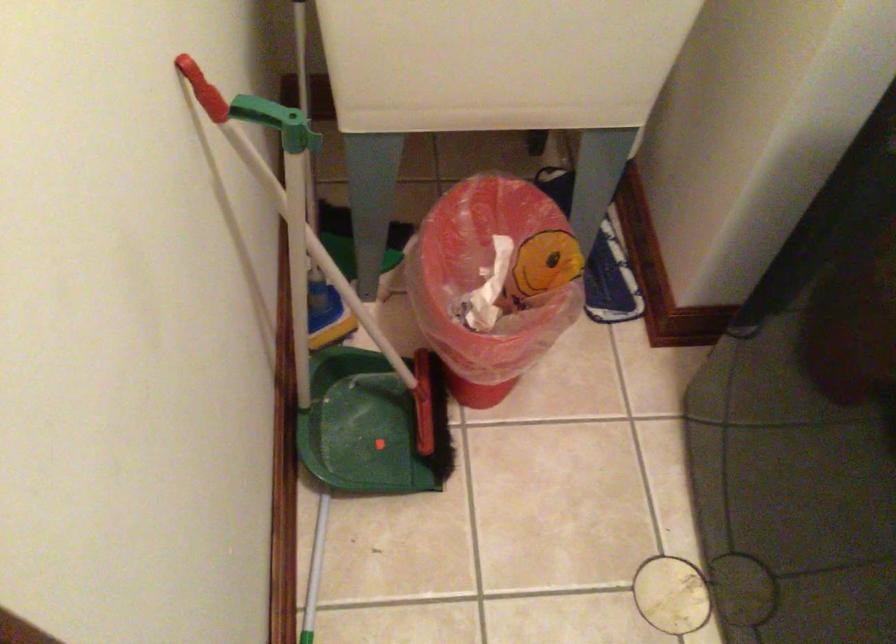
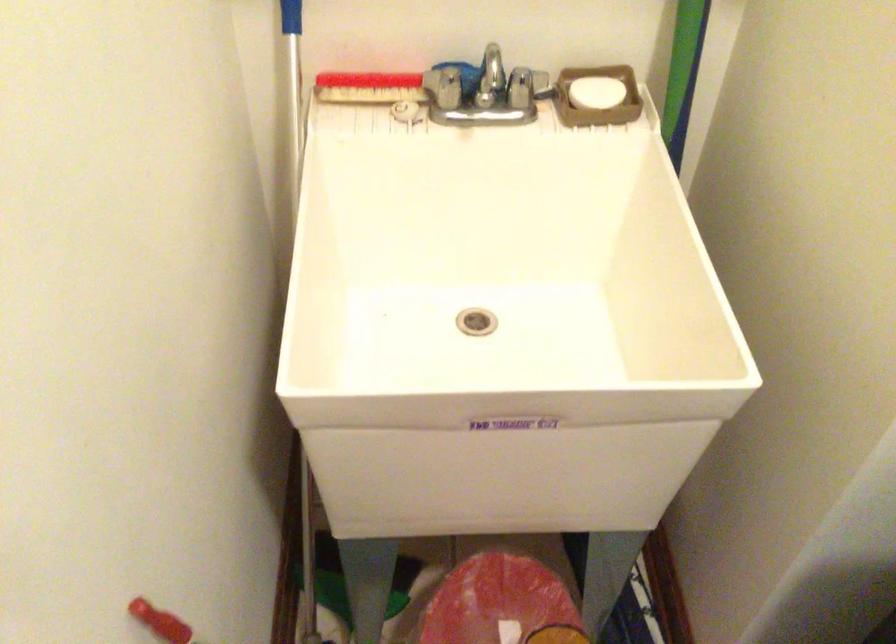
Question: What movement of the cameraman would produce the second image?

Choices:
 (A) Left
 (B) Right
 (C) Forward
 (D) Backward

Answer: (B)